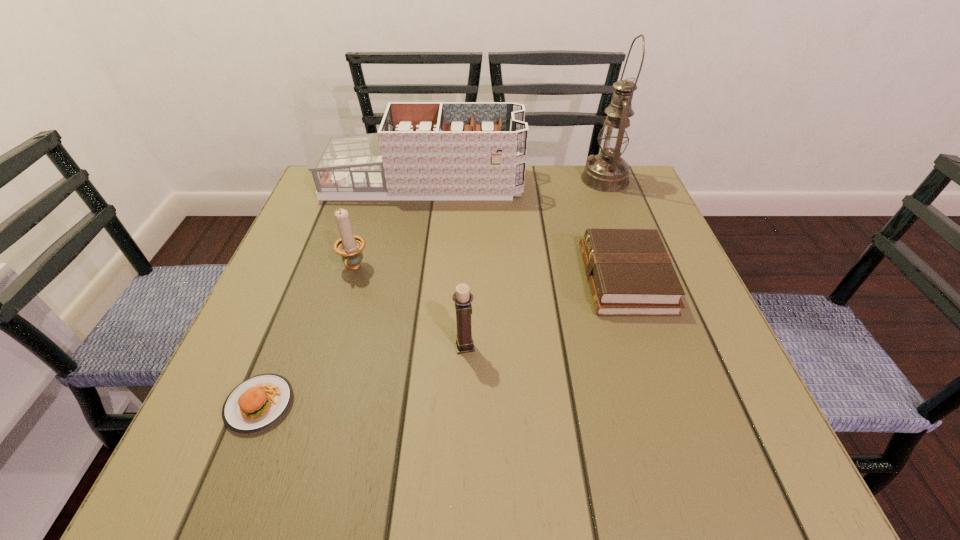
In order to click on candle_holder that is at the left edge in this screenshot , I will do `click(349, 246)`.

In order to click on food present at the left edge in this screenshot , I will do `click(257, 403)`.

The height and width of the screenshot is (540, 960). I want to click on oil lamp at the right edge, so click(607, 172).

Where is `Bible situated at the right edge`? Image resolution: width=960 pixels, height=540 pixels. Bible situated at the right edge is located at coordinates (630, 273).

At what (x,y) coordinates should I click in order to perform the action: click on object that is at the far left corner. Please return your answer as a coordinate pair (x, y). This screenshot has height=540, width=960. Looking at the image, I should click on (423, 150).

This screenshot has width=960, height=540. Identify the location of object that is positioned at the near left corner. (257, 403).

What are the coordinates of `object that is positioned at the far right corner` in the screenshot? It's located at (607, 172).

In the image, there is a desktop. Where is `free space at the far edge`? free space at the far edge is located at coordinates (450, 215).

Where is `blank area at the near edge`? Image resolution: width=960 pixels, height=540 pixels. blank area at the near edge is located at coordinates [x=380, y=437].

You are a GUI agent. You are given a task and a screenshot of the screen. Output one action in this format:
    pyautogui.click(x=<x>, y=<y>)
    Task: Click on the vacant area at the left edge of the desktop
    The image size is (960, 540).
    Given the screenshot: What is the action you would take?
    pyautogui.click(x=335, y=231)